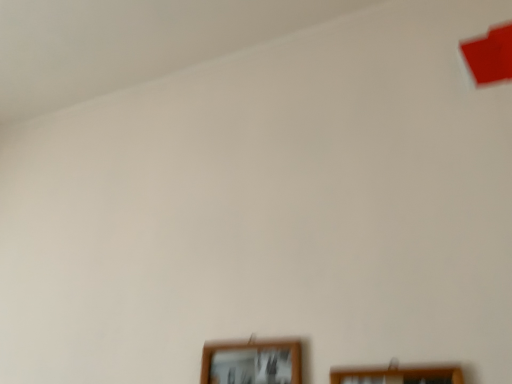
Describe the element at coordinates (252, 362) in the screenshot. This screenshot has width=512, height=384. I see `wooden picture frame at lower center, marked as the 2th picture frame in a right-to-left arrangement` at that location.

Measure the distance between wooden picture frame at lower center, which ranks as the 1th picture frame in left-to-right order, and camera.

wooden picture frame at lower center, which ranks as the 1th picture frame in left-to-right order, is 35.03 inches from camera.

Identify the location of wooden picture frame at lower center, which ranks as the 1th picture frame in left-to-right order. (252, 362).

The image size is (512, 384). What do you see at coordinates (398, 375) in the screenshot? I see `wooden picture frame at lower right, the 1th picture frame viewed from the right` at bounding box center [398, 375].

How much space does wooden picture frame at lower right, the 1th picture frame viewed from the right, occupy vertically?

wooden picture frame at lower right, the 1th picture frame viewed from the right, is 13.02 inches tall.

The width and height of the screenshot is (512, 384). I want to click on wooden picture frame at lower right, the 1th picture frame viewed from the right, so click(398, 375).

You are a GUI agent. You are given a task and a screenshot of the screen. Output one action in this format:
    pyautogui.click(x=<x>, y=<y>)
    Task: Click on the wooden picture frame at lower center, which ranks as the 1th picture frame in left-to-right order
    
    Given the screenshot: What is the action you would take?
    pyautogui.click(x=252, y=362)

From the picture: Considering the relative positions of wooden picture frame at lower center, which ranks as the 1th picture frame in left-to-right order, and wooden picture frame at lower right, the 1th picture frame viewed from the right, in the image provided, is wooden picture frame at lower center, which ranks as the 1th picture frame in left-to-right order, to the left of wooden picture frame at lower right, the 1th picture frame viewed from the right, from the viewer's perspective?

Correct, you'll find wooden picture frame at lower center, which ranks as the 1th picture frame in left-to-right order, to the left of wooden picture frame at lower right, the 1th picture frame viewed from the right.

Is the depth of wooden picture frame at lower center, which ranks as the 1th picture frame in left-to-right order, less than that of wooden picture frame at lower right, which ranks as the 2th picture frame in left-to-right order?

No, wooden picture frame at lower center, which ranks as the 1th picture frame in left-to-right order, is further to the viewer.

Which is farther from the camera, (267, 349) or (348, 380)?

The point (267, 349) is behind.

From the image's perspective, does wooden picture frame at lower center, which ranks as the 1th picture frame in left-to-right order, appear higher than wooden picture frame at lower right, which ranks as the 2th picture frame in left-to-right order?

No, from the image's perspective, wooden picture frame at lower center, which ranks as the 1th picture frame in left-to-right order, is not over wooden picture frame at lower right, which ranks as the 2th picture frame in left-to-right order.

From a real-world perspective, is wooden picture frame at lower center, which ranks as the 1th picture frame in left-to-right order, positioned above or below wooden picture frame at lower right, the 1th picture frame viewed from the right?

In terms of real-world spatial position, wooden picture frame at lower center, which ranks as the 1th picture frame in left-to-right order, is above wooden picture frame at lower right, the 1th picture frame viewed from the right.

Between wooden picture frame at lower center, which ranks as the 1th picture frame in left-to-right order, and wooden picture frame at lower right, the 1th picture frame viewed from the right, which one has smaller width?

wooden picture frame at lower right, the 1th picture frame viewed from the right.

Is wooden picture frame at lower center, marked as the 2th picture frame in a right-to-left arrangement, shorter than wooden picture frame at lower right, the 1th picture frame viewed from the right?

In fact, wooden picture frame at lower center, marked as the 2th picture frame in a right-to-left arrangement, may be taller than wooden picture frame at lower right, the 1th picture frame viewed from the right.

Can you confirm if wooden picture frame at lower center, which ranks as the 1th picture frame in left-to-right order, is bigger than wooden picture frame at lower right, the 1th picture frame viewed from the right?

Correct, wooden picture frame at lower center, which ranks as the 1th picture frame in left-to-right order, is larger in size than wooden picture frame at lower right, the 1th picture frame viewed from the right.

Based on the photo, is wooden picture frame at lower center, marked as the 2th picture frame in a right-to-left arrangement, inside or outside of wooden picture frame at lower right, which ranks as the 2th picture frame in left-to-right order?

wooden picture frame at lower center, marked as the 2th picture frame in a right-to-left arrangement, is outside wooden picture frame at lower right, which ranks as the 2th picture frame in left-to-right order.

Is wooden picture frame at lower center, marked as the 2th picture frame in a right-to-left arrangement, directly adjacent to wooden picture frame at lower right, the 1th picture frame viewed from the right?

No.

Is wooden picture frame at lower center, which ranks as the 1th picture frame in left-to-right order, aimed at wooden picture frame at lower right, which ranks as the 2th picture frame in left-to-right order?

No, wooden picture frame at lower center, which ranks as the 1th picture frame in left-to-right order, is not turned towards wooden picture frame at lower right, which ranks as the 2th picture frame in left-to-right order.

What's the angular difference between wooden picture frame at lower center, marked as the 2th picture frame in a right-to-left arrangement, and wooden picture frame at lower right, which ranks as the 2th picture frame in left-to-right order,'s facing directions?

There is a 2.09-degree angle between the facing directions of wooden picture frame at lower center, marked as the 2th picture frame in a right-to-left arrangement, and wooden picture frame at lower right, which ranks as the 2th picture frame in left-to-right order.

Identify the location of picture frame that is above the wooden picture frame at lower right, which ranks as the 2th picture frame in left-to-right order (from a real-world perspective). (252, 362).

Can you confirm if wooden picture frame at lower right, which ranks as the 2th picture frame in left-to-right order, is positioned to the right of wooden picture frame at lower center, which ranks as the 1th picture frame in left-to-right order?

Indeed, wooden picture frame at lower right, which ranks as the 2th picture frame in left-to-right order, is positioned on the right side of wooden picture frame at lower center, which ranks as the 1th picture frame in left-to-right order.

Is wooden picture frame at lower right, the 1th picture frame viewed from the right, further to the viewer compared to wooden picture frame at lower center, which ranks as the 1th picture frame in left-to-right order?

No, wooden picture frame at lower right, the 1th picture frame viewed from the right, is in front of wooden picture frame at lower center, which ranks as the 1th picture frame in left-to-right order.

Is point (420, 376) farther from viewer compared to point (280, 365)?

No, it is in front of (280, 365).

From the image's perspective, is wooden picture frame at lower right, the 1th picture frame viewed from the right, positioned above or below wooden picture frame at lower center, which ranks as the 1th picture frame in left-to-right order?

Based on their image positions, wooden picture frame at lower right, the 1th picture frame viewed from the right, is located above wooden picture frame at lower center, which ranks as the 1th picture frame in left-to-right order.

From a real-world perspective, relative to wooden picture frame at lower center, marked as the 2th picture frame in a right-to-left arrangement, is wooden picture frame at lower right, the 1th picture frame viewed from the right, vertically above or below?

wooden picture frame at lower right, the 1th picture frame viewed from the right, is below wooden picture frame at lower center, marked as the 2th picture frame in a right-to-left arrangement.

Looking at their sizes, would you say wooden picture frame at lower right, which ranks as the 2th picture frame in left-to-right order, is wider or thinner than wooden picture frame at lower center, which ranks as the 1th picture frame in left-to-right order?

Clearly, wooden picture frame at lower right, which ranks as the 2th picture frame in left-to-right order, has less width compared to wooden picture frame at lower center, which ranks as the 1th picture frame in left-to-right order.

Between wooden picture frame at lower right, the 1th picture frame viewed from the right, and wooden picture frame at lower center, which ranks as the 1th picture frame in left-to-right order, which one has less height?

wooden picture frame at lower right, the 1th picture frame viewed from the right.

Consider the image. Is wooden picture frame at lower right, the 1th picture frame viewed from the right, bigger than wooden picture frame at lower center, marked as the 2th picture frame in a right-to-left arrangement?

Actually, wooden picture frame at lower right, the 1th picture frame viewed from the right, might be smaller than wooden picture frame at lower center, marked as the 2th picture frame in a right-to-left arrangement.

Is wooden picture frame at lower right, the 1th picture frame viewed from the right, positioned beyond the bounds of wooden picture frame at lower center, which ranks as the 1th picture frame in left-to-right order?

Yes, wooden picture frame at lower right, the 1th picture frame viewed from the right, is not within wooden picture frame at lower center, which ranks as the 1th picture frame in left-to-right order.

Is wooden picture frame at lower right, which ranks as the 2th picture frame in left-to-right order, not near wooden picture frame at lower center, marked as the 2th picture frame in a right-to-left arrangement?

No, wooden picture frame at lower right, which ranks as the 2th picture frame in left-to-right order, is not far away from wooden picture frame at lower center, marked as the 2th picture frame in a right-to-left arrangement.

Is wooden picture frame at lower right, the 1th picture frame viewed from the right, oriented towards wooden picture frame at lower center, which ranks as the 1th picture frame in left-to-right order?

No, wooden picture frame at lower right, the 1th picture frame viewed from the right, does not turn towards wooden picture frame at lower center, which ranks as the 1th picture frame in left-to-right order.

What's the angular difference between wooden picture frame at lower right, which ranks as the 2th picture frame in left-to-right order, and wooden picture frame at lower center, marked as the 2th picture frame in a right-to-left arrangement,'s facing directions?

The angle between the facing direction of wooden picture frame at lower right, which ranks as the 2th picture frame in left-to-right order, and the facing direction of wooden picture frame at lower center, marked as the 2th picture frame in a right-to-left arrangement, is 2.09 degrees.

In order to click on picture frame above the wooden picture frame at lower center, marked as the 2th picture frame in a right-to-left arrangement (from the image's perspective) in this screenshot , I will do (x=398, y=375).

At what (x,y) coordinates should I click in order to perform the action: click on picture frame on the right of wooden picture frame at lower center, marked as the 2th picture frame in a right-to-left arrangement. Please return your answer as a coordinate pair (x, y). The image size is (512, 384). Looking at the image, I should click on (398, 375).

In order to click on picture frame below the wooden picture frame at lower center, which ranks as the 1th picture frame in left-to-right order (from a real-world perspective) in this screenshot , I will do `click(398, 375)`.